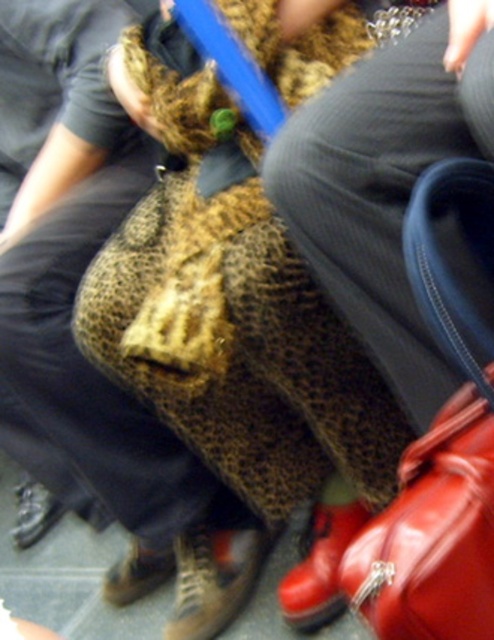
Is point (153, 556) closer to viewer compared to point (51, 506)?

That is True.

In the scene shown: Does brown leather shoe at lower center appear under brown leather shoe at lower left?

Indeed, brown leather shoe at lower center is positioned under brown leather shoe at lower left.

What do you see at coordinates (136, 573) in the screenshot?
I see `brown leather shoe at lower center` at bounding box center [136, 573].

Locate an element on the screen. The height and width of the screenshot is (640, 494). brown leather shoe at lower center is located at coordinates (136, 573).

Which is below, leather handbag at lower right or brown leather shoe at lower center?

Positioned lower is brown leather shoe at lower center.

Does leather handbag at lower right appear on the left side of brown leather shoe at lower center?

Incorrect, leather handbag at lower right is not on the left side of brown leather shoe at lower center.

Image resolution: width=494 pixels, height=640 pixels. What are the coordinates of `leather handbag at lower right` in the screenshot? It's located at (438, 452).

Identify the location of leather handbag at lower right. The height and width of the screenshot is (640, 494). (438, 452).

Which of these two, leather handbag at lower right or leather boot at lower center, stands shorter?

With less height is leather boot at lower center.

Is point (410, 508) positioned in front of point (219, 611)?

That is True.

Where is `leather handbag at lower right`? leather handbag at lower right is located at coordinates (438, 452).